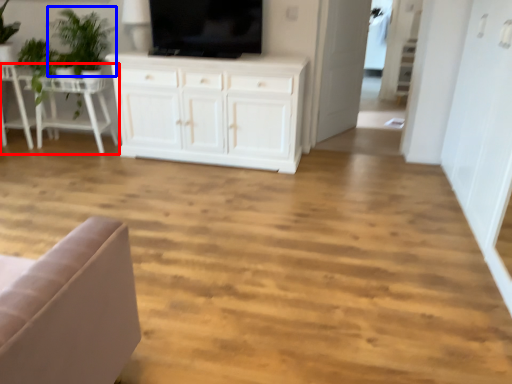
Question: Among these objects, which one is nearest to the camera, table (highlighted by a red box) or plant (highlighted by a blue box)?

Choices:
 (A) table
 (B) plant

Answer: (B)